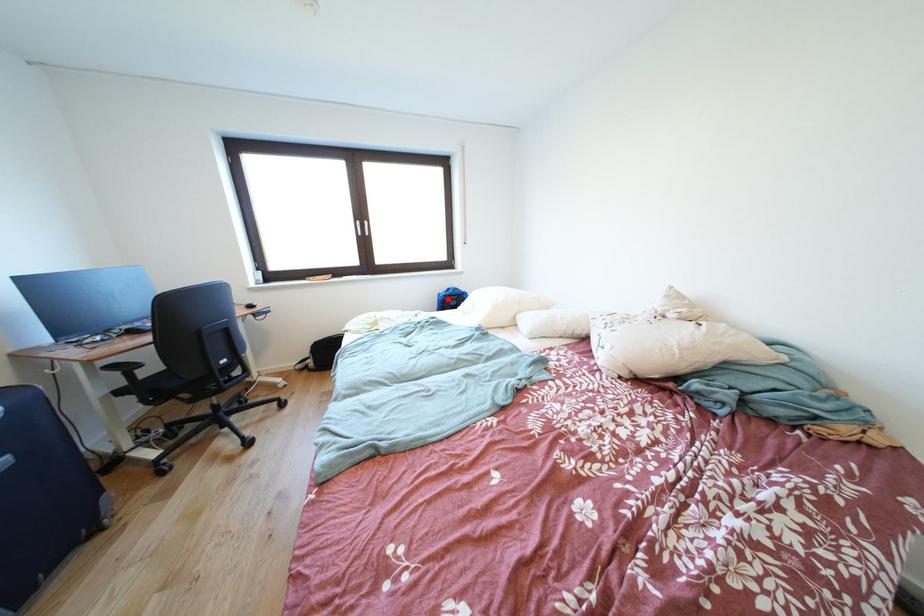
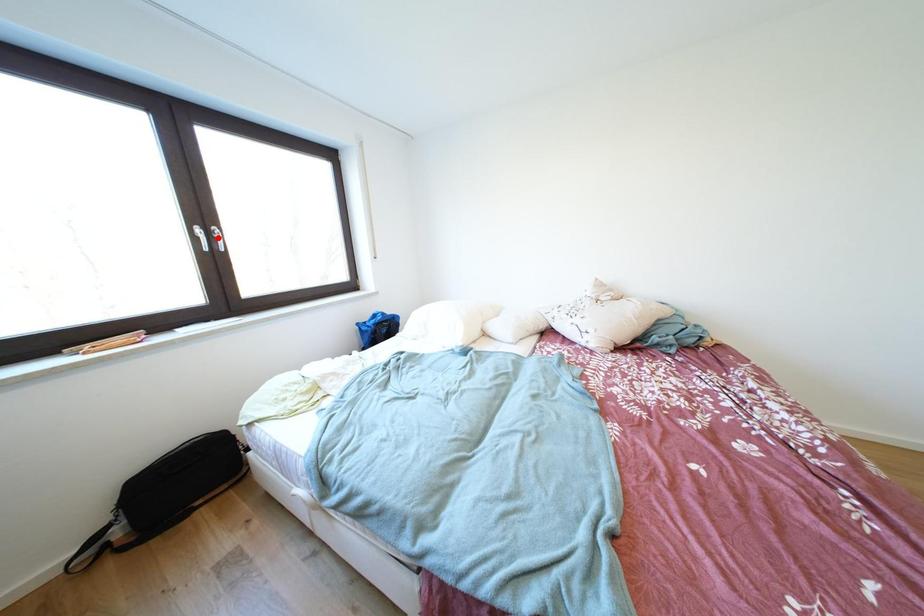
I am providing you with two images of the same scene from different viewpoints. A red point is marked on the first image and another point is marked on the second image. Are the points marked in image1 and image2 representing the same 3D position?

No